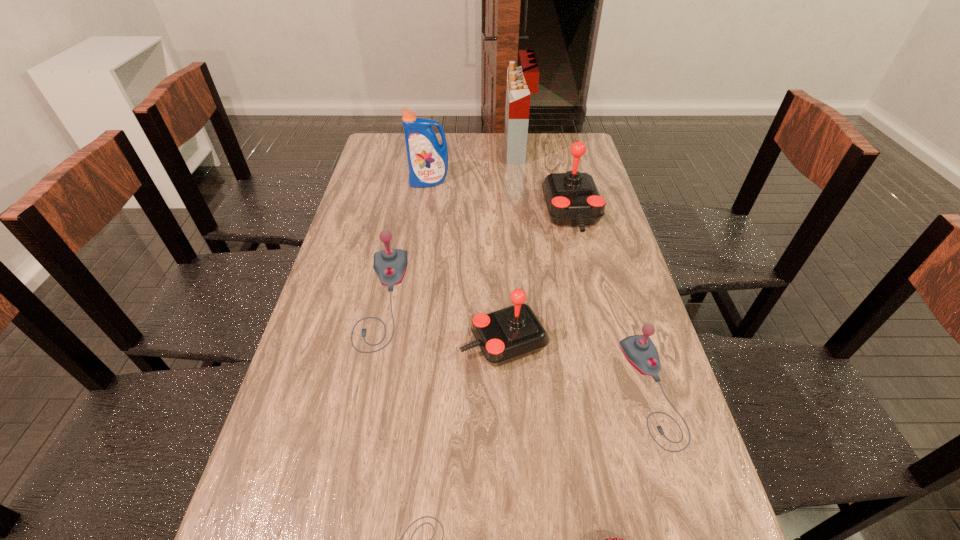
Where is `the fourth tallest joystick`? The image size is (960, 540). the fourth tallest joystick is located at coordinates (639, 350).

I want to click on the rightmost gray joystick, so click(x=639, y=350).

I want to click on free location located 0.080m with the lid open on the red cigarette case, so click(x=485, y=150).

I want to click on vacant space located 0.230m with the lid open on the red cigarette case, so click(446, 150).

Identify the location of free spot located 0.120m with the lid open on the red cigarette case. (475, 150).

Locate an element on the screen. free spot located on the label of the detergent is located at coordinates (421, 234).

The image size is (960, 540). I want to click on free location located on the front of the right red joystick, so click(x=587, y=277).

This screenshot has height=540, width=960. In order to click on free space located 0.200m on the left of the nearer red joystick in this screenshot , I will do `click(378, 342)`.

Where is `free location located 0.290m on the back of the third tallest joystick`? free location located 0.290m on the back of the third tallest joystick is located at coordinates (403, 198).

Find the location of `vacant area located 0.210m on the left of the second biggest gray joystick`. vacant area located 0.210m on the left of the second biggest gray joystick is located at coordinates (535, 390).